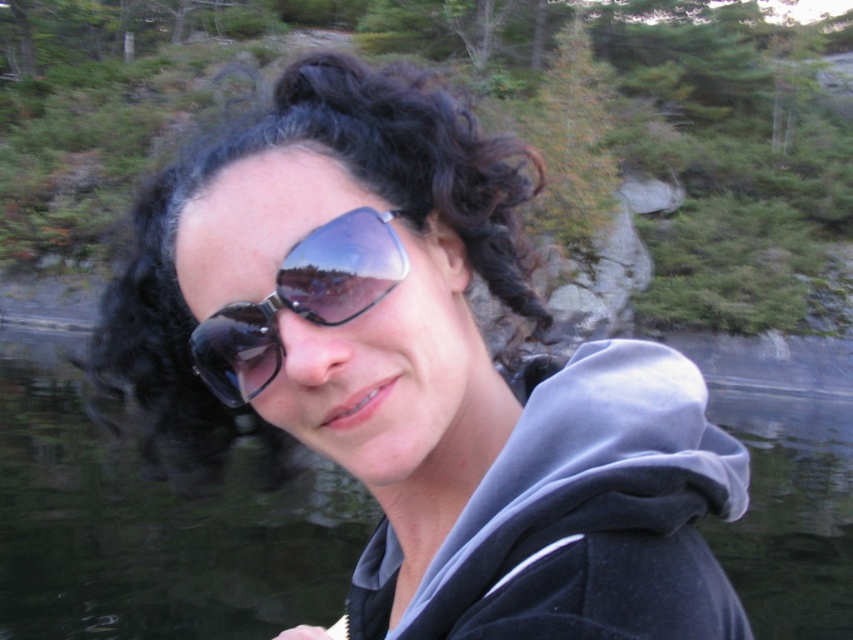
You are a photographer trying to capture the reflection of the matte black sunglasses at center in the transparent water at center. Based on their positions, can you determine if the sunglasses are visible in the reflection of the water?

The matte black sunglasses at center is positioned on the left side of transparent water at center. Since the sunglasses are placed to the left of the water, their reflection would appear on the right side of the water in the image. Therefore, the sunglasses are visible in the reflection of the transparent water at center.

You are a photographer trying to capture a reflection in the transparent water at center. The matte black sunglasses at center might block part of the reflection. Which object is shorter, allowing you to adjust your angle to avoid obstruction?

The matte black sunglasses at center is not as tall as transparent water at center, so it is shorter. Adjust your angle to focus on the taller transparent water at center to avoid obstruction.